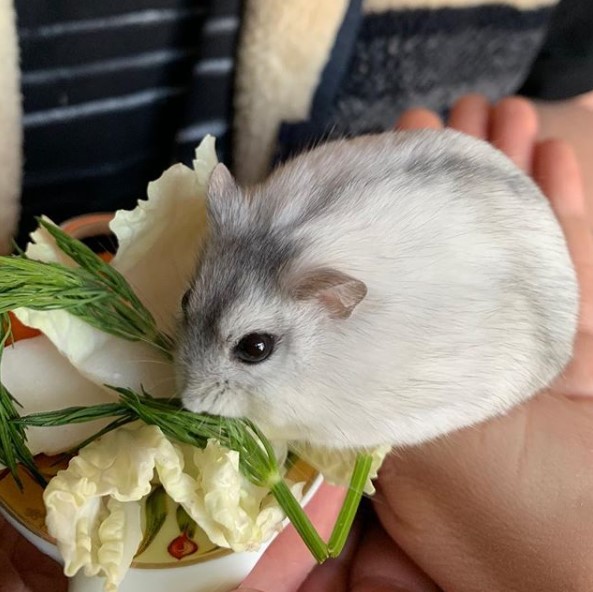
The height and width of the screenshot is (592, 593). Find the location of `white fur`. white fur is located at coordinates (409, 353).